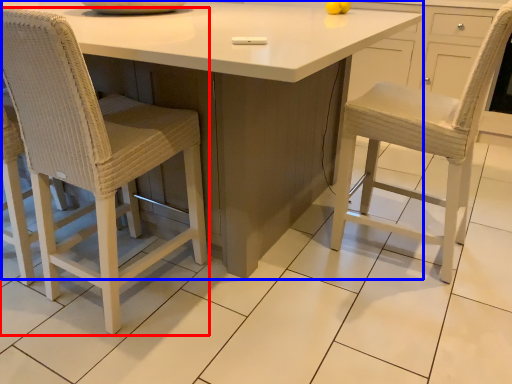
Question: Which object is closer to the camera taking this photo, chair (highlighted by a red box) or table (highlighted by a blue box)?

Choices:
 (A) chair
 (B) table

Answer: (B)